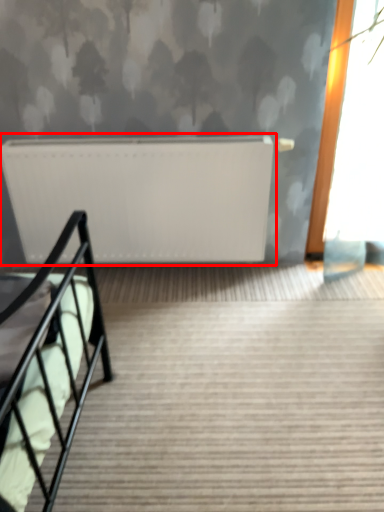
Question: From the image's perspective, considering the relative positions of radiator (annotated by the red box) and stairs in the image provided, where is radiator (annotated by the red box) located with respect to the staircase?

Choices:
 (A) above
 (B) below

Answer: (A)